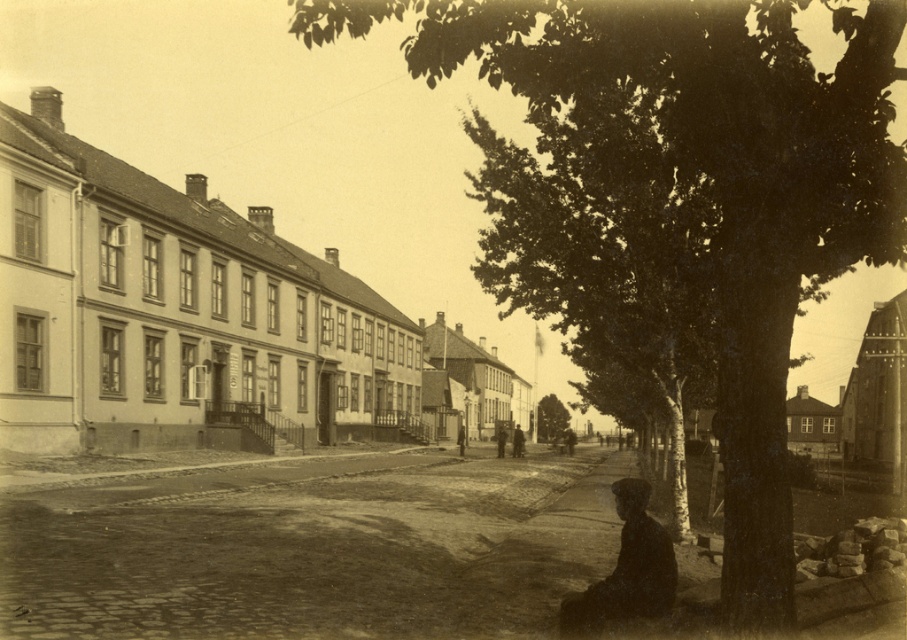
Who is lower down, smooth bark tree at center or green leafy tree at center?

Positioned lower is green leafy tree at center.

Does point (336, 28) come behind point (635, 284)?

No.

Is point (854, 221) less distant than point (589, 236)?

Yes, it is.

I want to click on smooth bark tree at center, so click(708, 182).

Is green leafy tree at center behind dark green textured tree at center?

No, green leafy tree at center is in front of dark green textured tree at center.

Can you confirm if green leafy tree at center is positioned to the right of dark green textured tree at center?

No, green leafy tree at center is not to the right of dark green textured tree at center.

The image size is (907, 640). What do you see at coordinates (606, 253) in the screenshot?
I see `green leafy tree at center` at bounding box center [606, 253].

Identify the location of green leafy tree at center. (606, 253).

Does smooth bark tree at center have a greater width compared to dark green textured tree at center?

Indeed, smooth bark tree at center has a greater width compared to dark green textured tree at center.

Is point (769, 506) positioned after point (540, 406)?

No, (769, 506) is closer to viewer.

Is point (719, 180) farther from viewer compared to point (554, 410)?

No, (719, 180) is in front of (554, 410).

This screenshot has height=640, width=907. Find the location of `smooth bark tree at center`. smooth bark tree at center is located at coordinates (708, 182).